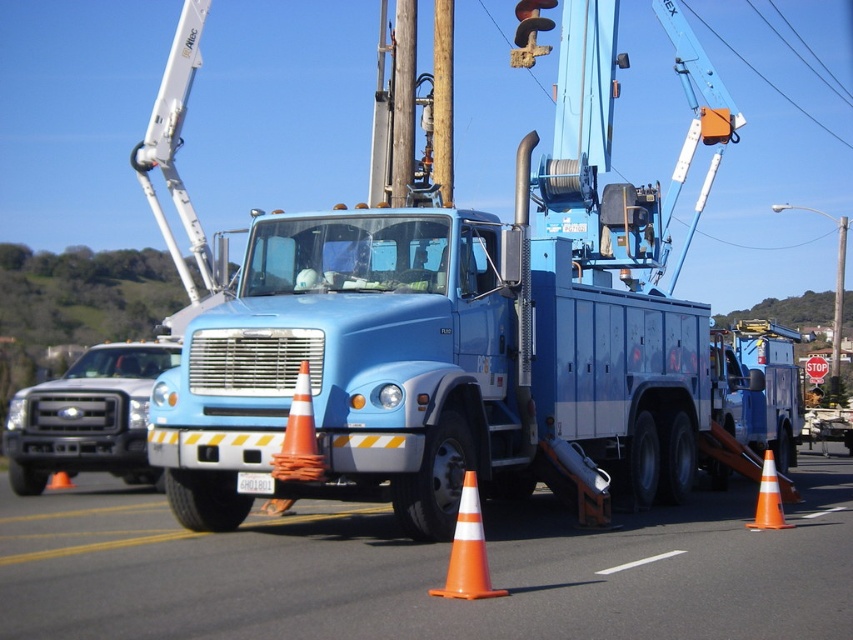
Question: Does brushed metal truck at left appear under orange/cone at lower center?

Choices:
 (A) no
 (B) yes

Answer: (A)

Question: Which object is positioned closest to the wooden pole at center?

Choices:
 (A) orange/cone at center
 (B) orange cable at upper center
 (C) orange plastic traffic cone at center
 (D) blue metallic utility truck at center

Answer: (D)

Question: Estimate the real-world distances between objects in this image. Which object is closer to the brushed metal truck at left?

Choices:
 (A) blue metallic utility truck at right
 (B) brushed metal telegraph pole at center

Answer: (A)

Question: Which object is closer to the camera taking this photo?

Choices:
 (A) orange/cone at center
 (B) brushed metal truck at left

Answer: (A)

Question: Can you confirm if orange/cone at lower center is positioned below orange cone at center?

Choices:
 (A) no
 (B) yes

Answer: (A)

Question: In this image, where is orange/cone at center located relative to orange cone at center?

Choices:
 (A) left
 (B) right

Answer: (B)